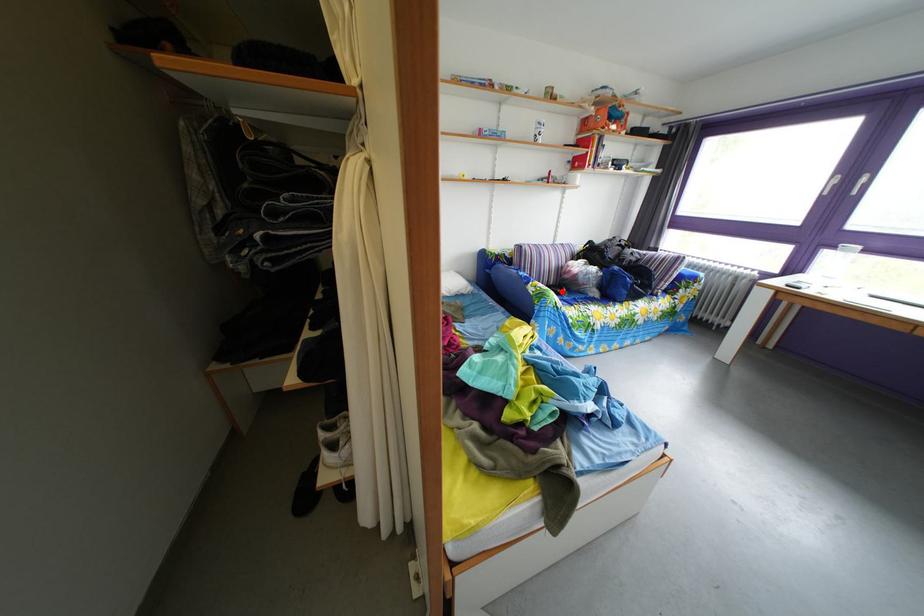
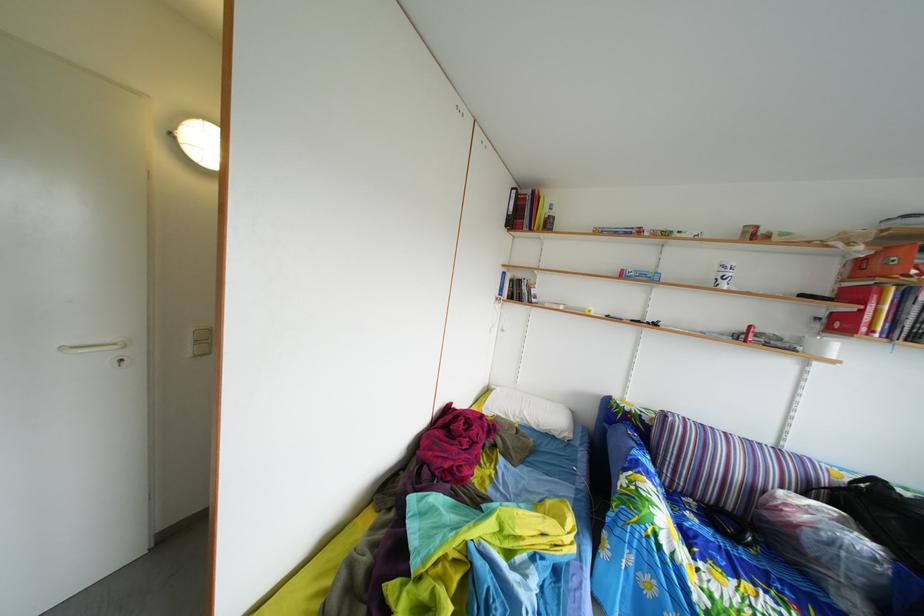
Locate, in the second image, the point that corresponds to the highlighted location in the first image.

(739, 516)